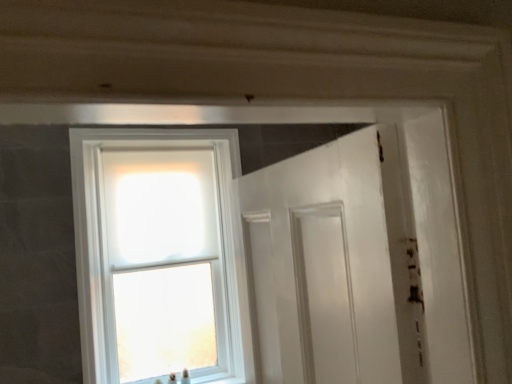
Question: Is white glossy door at center not inside clear glass window at upper left?

Choices:
 (A) yes
 (B) no

Answer: (A)

Question: From a real-world perspective, is white glossy door at center beneath clear glass window at upper left?

Choices:
 (A) yes
 (B) no

Answer: (A)

Question: Is white glossy door at center oriented towards clear glass window at upper left?

Choices:
 (A) yes
 (B) no

Answer: (B)

Question: From a real-world perspective, is white glossy door at center physically above clear glass window at upper left?

Choices:
 (A) yes
 (B) no

Answer: (B)

Question: Is white glossy door at center wider than clear glass window at upper left?

Choices:
 (A) yes
 (B) no

Answer: (B)

Question: From the image's perspective, is white glossy door at center on top of clear glass window at upper left?

Choices:
 (A) yes
 (B) no

Answer: (B)

Question: Is clear glass window at upper left closer to camera compared to white glossy door at center?

Choices:
 (A) no
 (B) yes

Answer: (B)

Question: Could white glossy door at center be considered to be inside clear glass window at upper left?

Choices:
 (A) yes
 (B) no

Answer: (B)

Question: Does clear glass window at upper left come behind white glossy door at center?

Choices:
 (A) yes
 (B) no

Answer: (B)

Question: Are clear glass window at upper left and white glossy door at center beside each other?

Choices:
 (A) no
 (B) yes

Answer: (A)

Question: Is clear glass window at upper left thinner than white glossy door at center?

Choices:
 (A) no
 (B) yes

Answer: (A)

Question: Is clear glass window at upper left positioned far away from white glossy door at center?

Choices:
 (A) no
 (B) yes

Answer: (B)

Question: Would you say white glossy door at center is inside or outside clear glass window at upper left?

Choices:
 (A) inside
 (B) outside

Answer: (B)